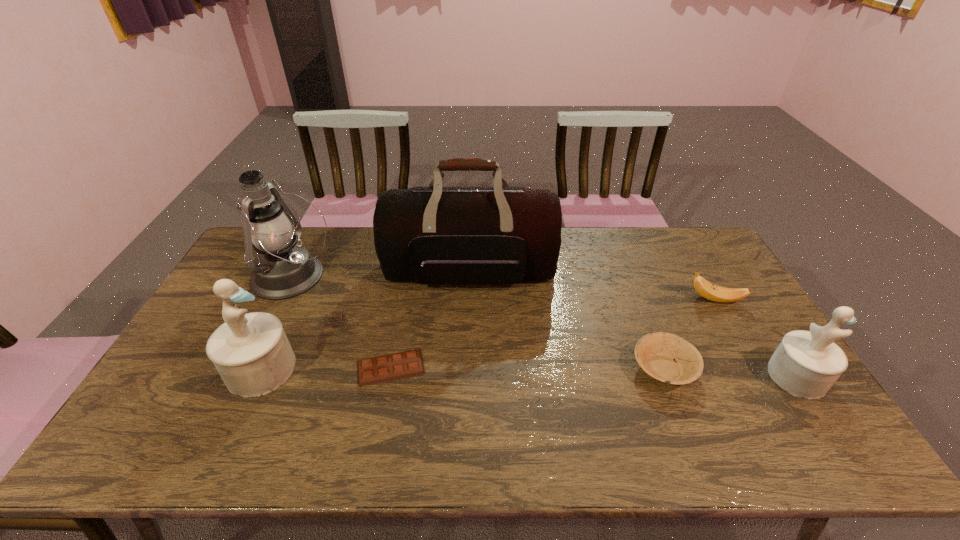
Find the location of `the taller figurine`. the taller figurine is located at coordinates click(x=251, y=352).

The image size is (960, 540). I want to click on the left figurine, so click(x=251, y=352).

What are the coordinates of `the fourth tallest object` in the screenshot? It's located at (806, 364).

Identify the location of the right figurine. (806, 364).

Where is `duffel bag`? This screenshot has width=960, height=540. duffel bag is located at coordinates (429, 235).

You are a GUI agent. You are given a task and a screenshot of the screen. Output one action in this format:
    pyautogui.click(x=<x>, y=<y>)
    Task: Click on the banana
    This screenshot has width=960, height=540.
    Given the screenshot: What is the action you would take?
    pyautogui.click(x=712, y=292)

Image resolution: width=960 pixels, height=540 pixels. I want to click on oil lamp, so click(x=282, y=270).

This screenshot has height=540, width=960. Identify the location of the shortest object. (x=394, y=366).

Where is `the third object from right to left`? This screenshot has width=960, height=540. the third object from right to left is located at coordinates pyautogui.click(x=655, y=353).

Locate an element on the screen. The height and width of the screenshot is (540, 960). the sixth tallest object is located at coordinates (655, 353).